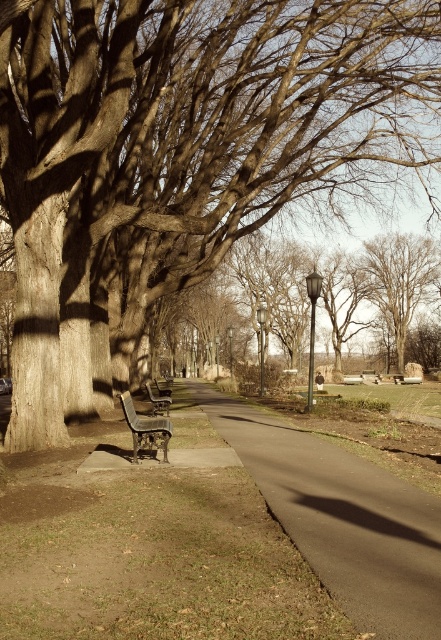
Question: Considering the relative positions of brown wood tree at left and matte black lamp post at center in the image provided, where is brown wood tree at left located with respect to matte black lamp post at center?

Choices:
 (A) left
 (B) right

Answer: (A)

Question: Which point is farther to the camera?

Choices:
 (A) (165, 406)
 (B) (231, 368)
 (C) (129, 394)
 (D) (220, 403)

Answer: (B)

Question: Which of the following is the closest to the observer?

Choices:
 (A) wooden park bench at center
 (B) matte black lamp post at center
 (C) metallic pole at center-right
 (D) brown wood tree at left

Answer: (D)

Question: Which point appears closest to the camera in this image?

Choices:
 (A) (153, 400)
 (B) (262, 378)

Answer: (A)

Question: Can you confirm if metallic gray lamp post at center is positioned to the left of black metal lamp post at center?

Choices:
 (A) no
 (B) yes

Answer: (A)

Question: Is metallic pole at center-right above metallic gray lamp post at center?

Choices:
 (A) no
 (B) yes

Answer: (B)